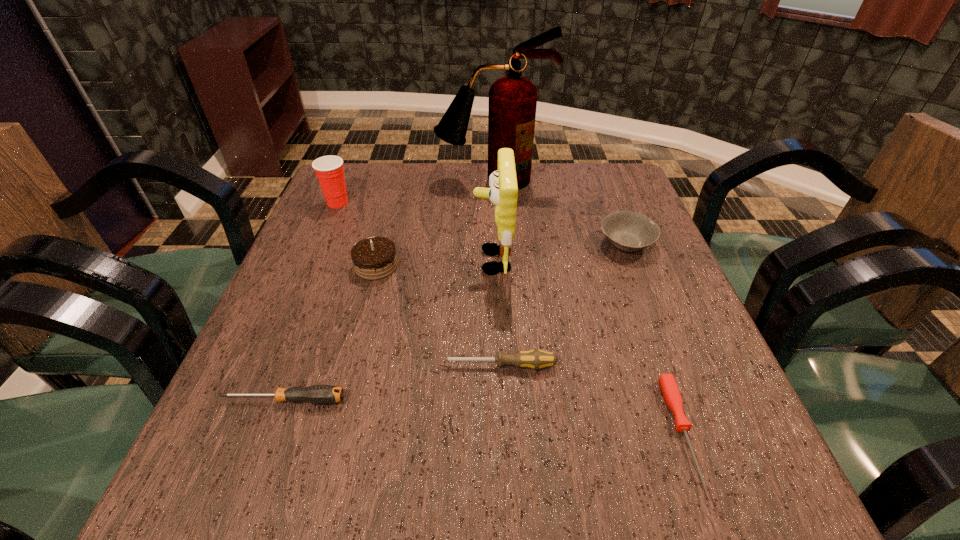
Identify the location of screwdriver located in the right edge section of the desktop. The width and height of the screenshot is (960, 540). [x=671, y=393].

Locate an element on the screen. This screenshot has width=960, height=540. object present at the far left corner is located at coordinates (329, 169).

Locate an element on the screen. The height and width of the screenshot is (540, 960). object positioned at the near right corner is located at coordinates (671, 393).

This screenshot has height=540, width=960. In the image, there is a desktop. Find the location of `vacant space at the far edge`. vacant space at the far edge is located at coordinates (396, 208).

The height and width of the screenshot is (540, 960). Find the location of `vacant region at the near edge of the desktop`. vacant region at the near edge of the desktop is located at coordinates (388, 462).

You are a GUI agent. You are given a task and a screenshot of the screen. Output one action in this format:
    pyautogui.click(x=<x>, y=<y>)
    Task: Click on the free spot at the left edge of the desktop
    
    Given the screenshot: What is the action you would take?
    pyautogui.click(x=244, y=443)

Identify the location of vacant space at the right edge of the desktop. The width and height of the screenshot is (960, 540). (627, 356).

Identify the location of vacant space at the far left corner of the desktop. (375, 204).

Where is `free spot at the near left corner of the desktop`? The height and width of the screenshot is (540, 960). free spot at the near left corner of the desktop is located at coordinates (283, 468).

Locate an element on the screen. free space at the far right corner is located at coordinates (581, 167).